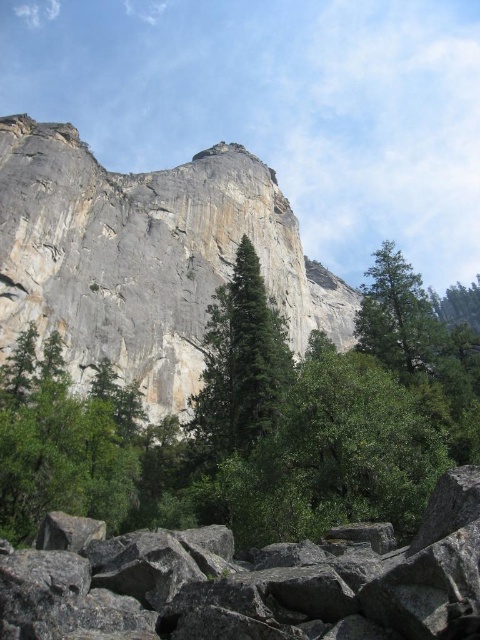
You are a hiker planning to set up a tent between the green matte tree at center and the green textured tree at lower right. The tent requires a minimum of 70 feet of space between the two trees to be safely anchored. Based on the distance provided, is this location suitable for setting up the tent?

The green matte tree at center and green textured tree at lower right are 68.39 feet apart from each other. Since the required minimum distance is 70 feet, the location is not suitable for setting up the tent as the distance is insufficient.